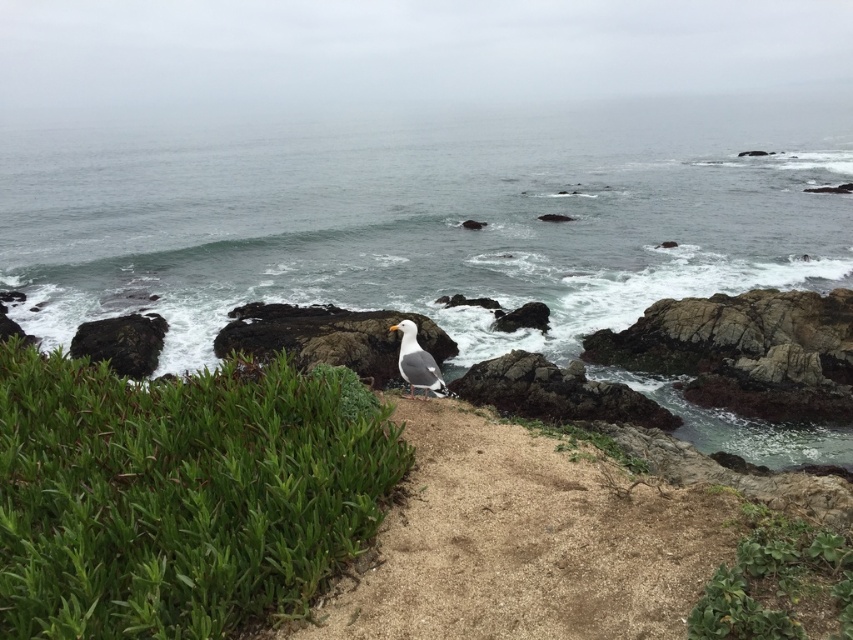
Question: Which of the following is the farthest from the observer?

Choices:
 (A) (721, 636)
 (B) (436, 394)
 (C) (401, 228)

Answer: (C)

Question: Where is clear water at center located in relation to green leafy plant at lower right in the image?

Choices:
 (A) above
 (B) below

Answer: (A)

Question: Among these points, which one is nearest to the camera?

Choices:
 (A) (410, 356)
 (B) (769, 625)
 (C) (474, 198)

Answer: (B)

Question: Observing the image, what is the correct spatial positioning of clear water at center in reference to green leafy plant at lower right?

Choices:
 (A) above
 (B) below

Answer: (A)

Question: Is clear water at center to the right of white feathered bird at center from the viewer's perspective?

Choices:
 (A) no
 (B) yes

Answer: (A)

Question: Which point is farther from the camera taking this photo?

Choices:
 (A) (802, 588)
 (B) (798, 256)
 (C) (419, 378)
 (D) (120, 586)

Answer: (B)